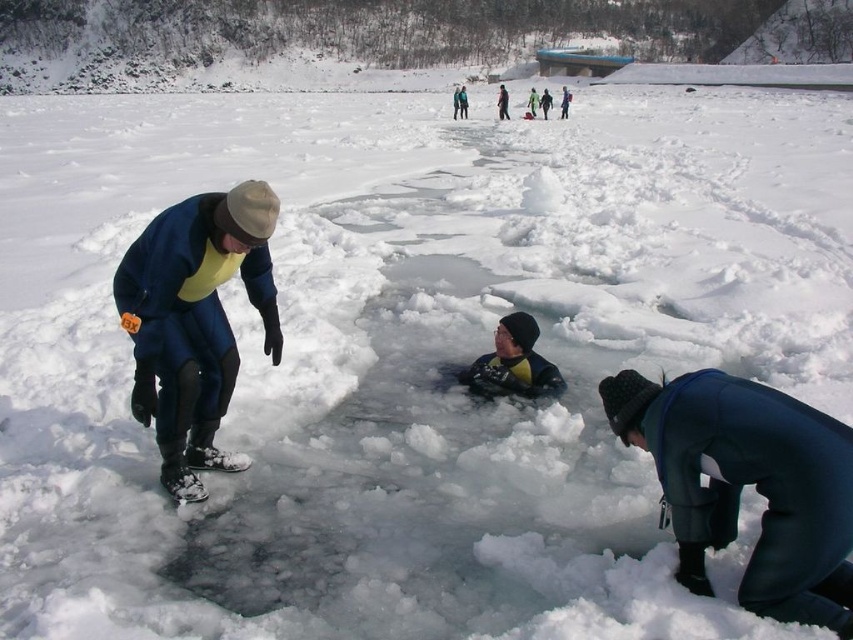
Does yellow rubber boots at center come in front of yellow rubber suit at center?

Yes, it is.

Is point (500, 115) farther from viewer compared to point (531, 90)?

No, it is in front of (531, 90).

You are a GUI agent. You are given a task and a screenshot of the screen. Output one action in this format:
    pyautogui.click(x=<x>, y=<y>)
    Task: Click on the yellow rubber boots at center
    This screenshot has height=640, width=853.
    Given the screenshot: What is the action you would take?
    pyautogui.click(x=502, y=102)

Is blue waterproof suit at center bigger than yellow rubber suit at center?

Correct, blue waterproof suit at center is larger in size than yellow rubber suit at center.

What are the coordinates of `blue waterproof suit at center` in the screenshot? It's located at (564, 100).

Describe the element at coordinates (564, 100) in the screenshot. I see `blue waterproof suit at center` at that location.

Identify the location of blue waterproof suit at center. (564, 100).

Is matte blue snowsuit at left shorter than yellow-green wetsuit at center?

Indeed, matte blue snowsuit at left has a lesser height compared to yellow-green wetsuit at center.

Is matte blue snowsuit at left bigger than yellow-green wetsuit at center?

No, matte blue snowsuit at left is not bigger than yellow-green wetsuit at center.

Where is `matte blue snowsuit at left`? This screenshot has height=640, width=853. matte blue snowsuit at left is located at coordinates 195,321.

Identify the location of matte blue snowsuit at left. The width and height of the screenshot is (853, 640). (195, 321).